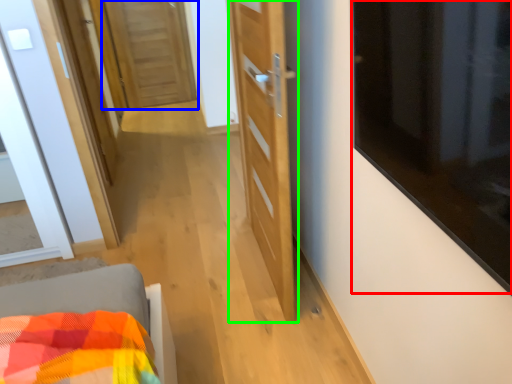
Question: Which object is positioned farthest from window (highlighted by a red box)? Select from door (highlighted by a blue box) and door (highlighted by a green box).

Choices:
 (A) door
 (B) door

Answer: (A)